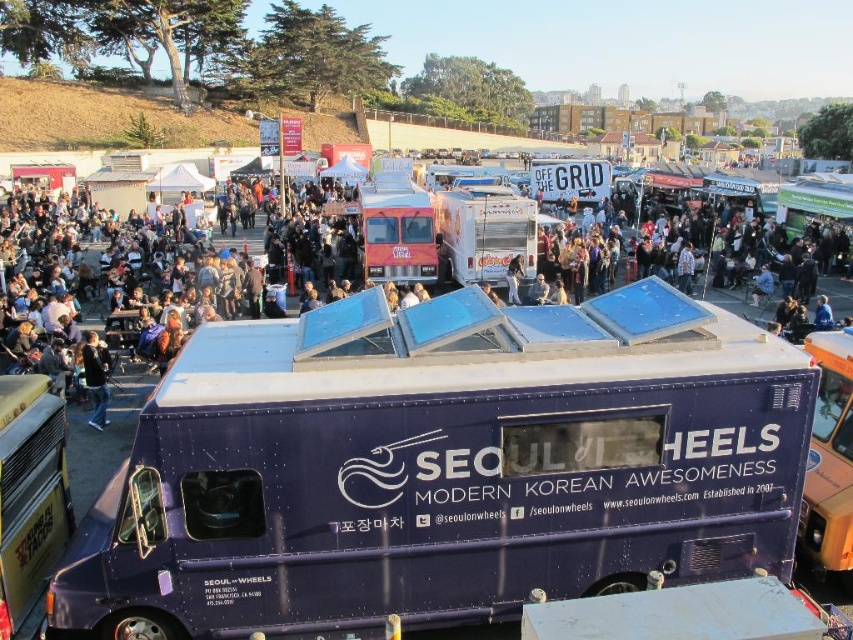
Question: Which is farther from the dark blue jeans at lower left?

Choices:
 (A) silver metallic food truck at center
 (B) metallic purple food truck at center

Answer: (A)

Question: Can you confirm if metallic purple food truck at center is bigger than dark blue jeans at lower left?

Choices:
 (A) yes
 (B) no

Answer: (B)

Question: Which point is farther to the camera?

Choices:
 (A) (103, 381)
 (B) (448, 257)

Answer: (B)

Question: Does metallic purple food truck at center appear on the right side of silver metallic food truck at center?

Choices:
 (A) yes
 (B) no

Answer: (A)

Question: Which of the following is the farthest from the observer?

Choices:
 (A) silver metallic food truck at center
 (B) dark blue jeans at lower left
 (C) metallic purple food truck at center

Answer: (A)

Question: Does metallic purple food truck at center appear on the left side of silver metallic food truck at center?

Choices:
 (A) no
 (B) yes

Answer: (A)